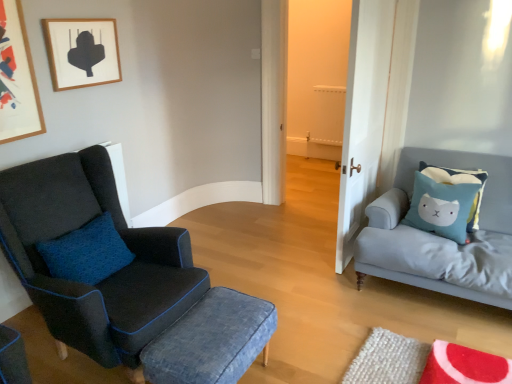
Question: From a real-world perspective, is wooden framed artwork at upper left, arranged as the 2th picture frame when viewed from the right, over light blue fabric cushion at right?

Choices:
 (A) yes
 (B) no

Answer: (A)

Question: Is the depth of wooden framed artwork at upper left, arranged as the 2th picture frame when viewed from the right, greater than that of light blue fabric cushion at right?

Choices:
 (A) no
 (B) yes

Answer: (A)

Question: Is light blue fabric cushion at right completely or partially inside wooden framed artwork at upper left, arranged as the 2th picture frame when viewed from the right?

Choices:
 (A) yes
 (B) no

Answer: (B)

Question: Considering the relative sizes of wooden framed artwork at upper left, arranged as the 2th picture frame when viewed from the right, and light blue fabric cushion at right in the image provided, is wooden framed artwork at upper left, arranged as the 2th picture frame when viewed from the right, wider than light blue fabric cushion at right?

Choices:
 (A) no
 (B) yes

Answer: (A)

Question: Can you confirm if wooden framed artwork at upper left, which is counted as the 1th picture frame, starting from the left, is smaller than light blue fabric cushion at right?

Choices:
 (A) yes
 (B) no

Answer: (A)

Question: From the image's perspective, is wooden framed artwork at upper left, arranged as the 2th picture frame when viewed from the right, over light blue fabric cushion at right?

Choices:
 (A) yes
 (B) no

Answer: (A)

Question: Is matte black armchair at left turned away from denim fabric stool at center?

Choices:
 (A) no
 (B) yes

Answer: (A)

Question: From a real-world perspective, is matte black armchair at left below denim fabric stool at center?

Choices:
 (A) no
 (B) yes

Answer: (A)

Question: Does matte black armchair at left have a smaller size compared to denim fabric stool at center?

Choices:
 (A) yes
 (B) no

Answer: (B)

Question: Is matte black armchair at left aimed at denim fabric stool at center?

Choices:
 (A) yes
 (B) no

Answer: (A)

Question: From a real-world perspective, is matte black armchair at left located higher than denim fabric stool at center?

Choices:
 (A) no
 (B) yes

Answer: (B)

Question: Is matte black armchair at left bigger than denim fabric stool at center?

Choices:
 (A) no
 (B) yes

Answer: (B)

Question: From a real-world perspective, is wooden picture frame at upper left, the second picture frame positioned from the left, over white wood door at center?

Choices:
 (A) yes
 (B) no

Answer: (A)